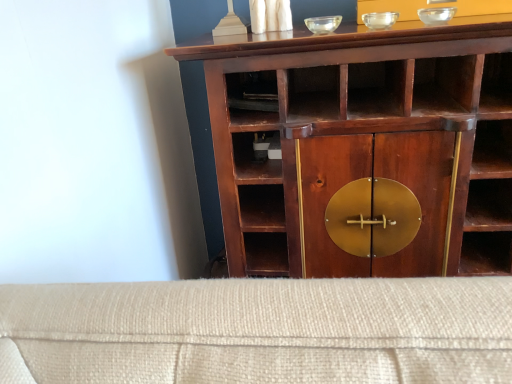
Question: Based on their positions, is mahogany wood cupboard at center located to the left or right of transparent glass bowl at upper center, positioned as the 2th glass bowl in right-to-left order?

Choices:
 (A) left
 (B) right

Answer: (B)

Question: Is point (246, 155) closer or farther from the camera than point (381, 23)?

Choices:
 (A) closer
 (B) farther

Answer: (B)

Question: Considering the real-world distances, which object is farthest from the transparent glass bowl at upper right, positioned as the 3th glass bowl in left-to-right order?

Choices:
 (A) mahogany wood cupboard at center
 (B) transparent glass bowl at upper center, marked as the first glass bowl in a left-to-right arrangement
 (C) transparent glass bowl at upper center, positioned as the 2th glass bowl in right-to-left order

Answer: (A)

Question: Estimate the real-world distances between objects in this image. Which object is closer to the transparent glass bowl at upper right, positioned as the 3th glass bowl in left-to-right order?

Choices:
 (A) transparent glass bowl at upper center, acting as the 3th glass bowl starting from the right
 (B) mahogany wood cupboard at center
 (C) transparent glass bowl at upper center, positioned as the 2th glass bowl in right-to-left order

Answer: (C)